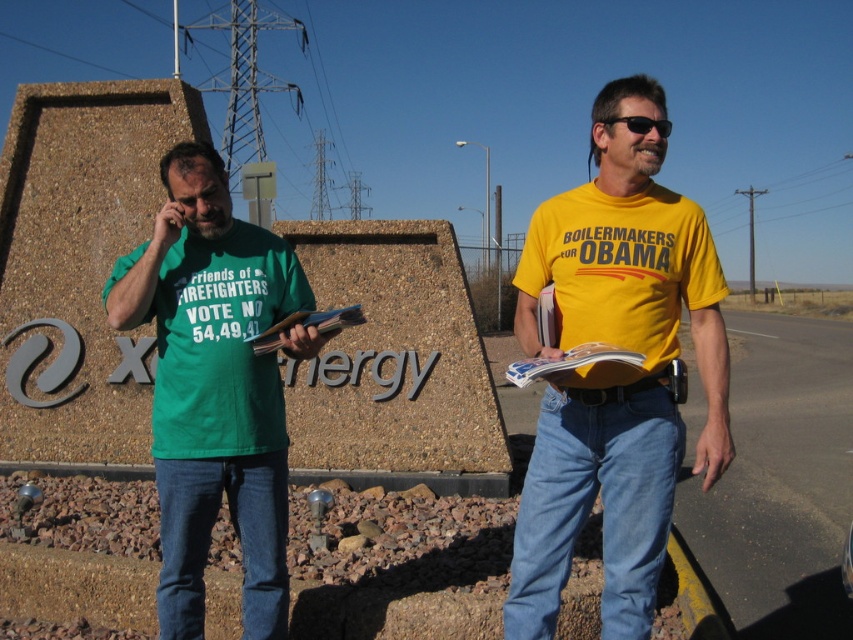
Does yellow t-shirt at center come in front of black plastic sunglasses at center?

Yes, yellow t-shirt at center is in front of black plastic sunglasses at center.

Is point (631, 596) positioned before point (641, 134)?

No, (631, 596) is behind (641, 134).

What do you see at coordinates (614, 371) in the screenshot? I see `yellow t-shirt at center` at bounding box center [614, 371].

Find the location of a particular element. This screenshot has height=640, width=853. yellow t-shirt at center is located at coordinates (614, 371).

In the scene shown: Does yellow t-shirt at center come behind green t-shirt at left?

No.

You are a GUI agent. You are given a task and a screenshot of the screen. Output one action in this format:
    pyautogui.click(x=<x>, y=<y>)
    Task: Click on the yellow t-shirt at center
    
    Given the screenshot: What is the action you would take?
    pyautogui.click(x=614, y=371)

Can you confirm if green t-shirt at left is shorter than black plastic sunglasses at center?

In fact, green t-shirt at left may be taller than black plastic sunglasses at center.

Who is shorter, green t-shirt at left or black plastic sunglasses at center?

black plastic sunglasses at center is shorter.

Which is behind, point (309, 305) or point (635, 116)?

The point (309, 305) is more distant.

Identify the location of green t-shirt at left. (213, 388).